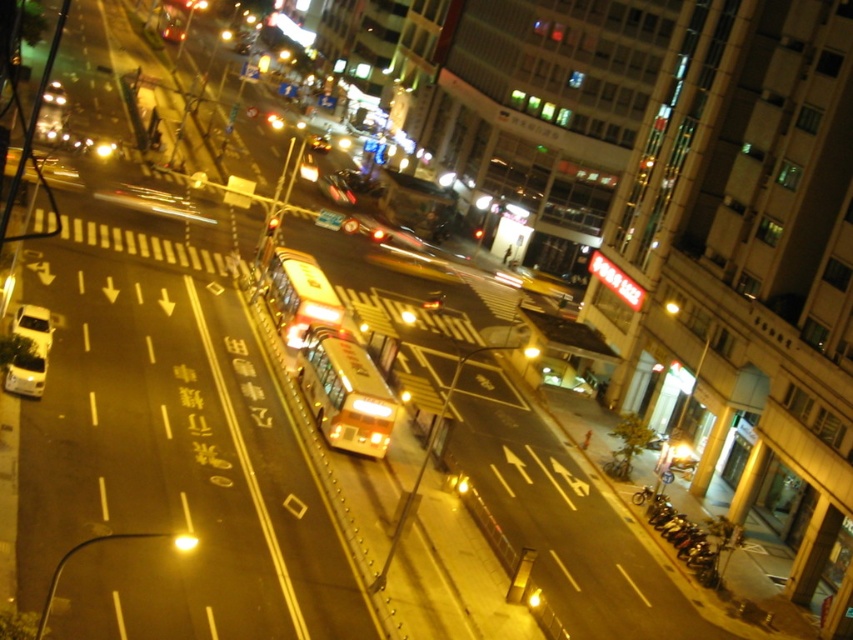
You are a pedestrian standing at the edge of the road and see both the yellow metallic bus at center and the metallic gold bus at center. Which one is closer to your left side?

The yellow metallic bus at center is to the left of the metallic gold bus at center, so it is closer to your left side.

You are standing at point (381, 196) and want to walk to point (357, 420). Which direction should you move relative to the bus?

You should move in the direction towards the front of the bus since point (357, 420) is in front of point (381, 196).

You are standing at the point with coordinates (x=299, y=296) in the image. What object are you standing on?

You are standing on the metallic orange bus at center, as the point (x=299, y=296) represents its location.